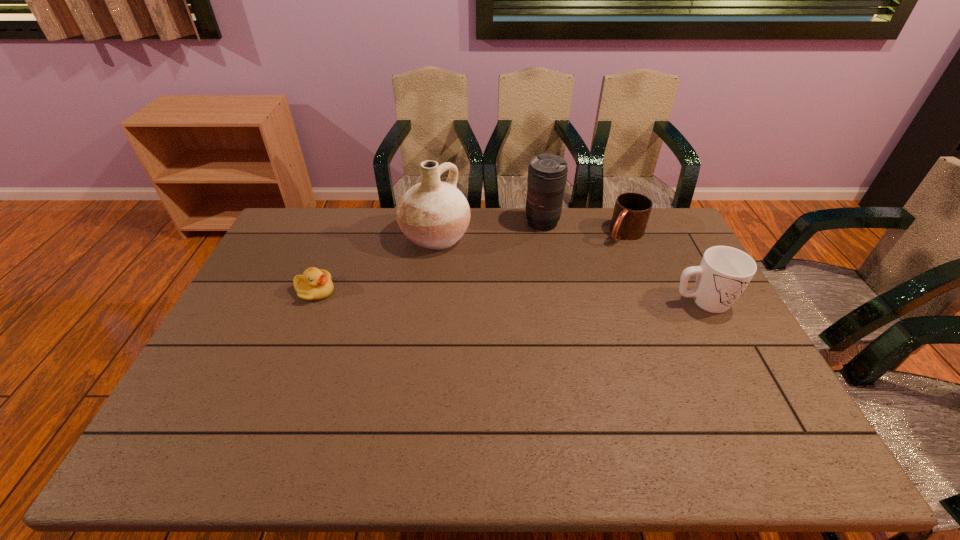
The width and height of the screenshot is (960, 540). I want to click on duckling, so click(x=315, y=284).

I want to click on the shortest object, so click(x=315, y=284).

Identify the location of the nearer mug. (724, 272).

Where is `the taller mug`? the taller mug is located at coordinates (724, 272).

Find the location of a particular element. the fourth object from right to left is located at coordinates (434, 215).

At what (x,y) coordinates should I click in order to perform the action: click on the farther mug. Please return your answer as a coordinate pair (x, y). The image size is (960, 540). Looking at the image, I should click on (631, 212).

Where is `the shorter mug`? Image resolution: width=960 pixels, height=540 pixels. the shorter mug is located at coordinates (631, 212).

At what (x,y) coordinates should I click in order to perform the action: click on the third object from right to left. Please return your answer as a coordinate pair (x, y). The width and height of the screenshot is (960, 540). Looking at the image, I should click on (547, 173).

At what (x,y) coordinates should I click in order to perform the action: click on the second tallest object. Please return your answer as a coordinate pair (x, y). The image size is (960, 540). Looking at the image, I should click on tap(547, 173).

This screenshot has height=540, width=960. Find the location of `free space located at the face of the shortest object`. free space located at the face of the shortest object is located at coordinates (389, 291).